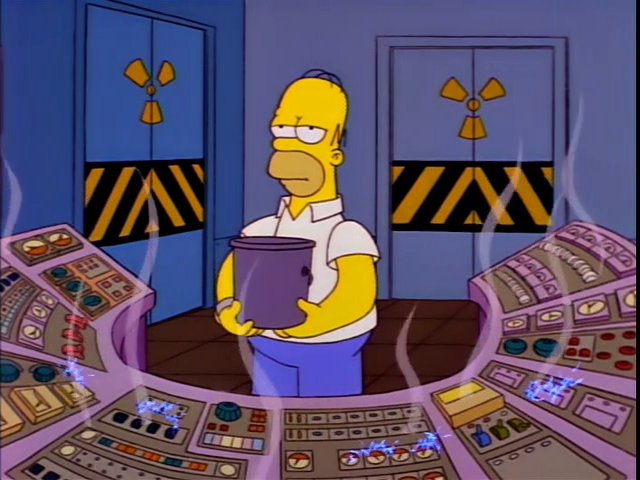
This screenshot has width=640, height=480. What are the coordinates of `bucket` in the screenshot? It's located at (267, 274).